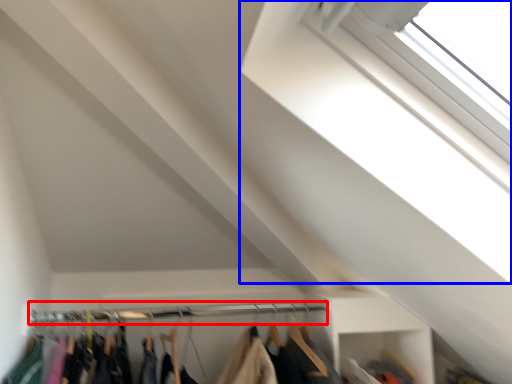
Question: Which of the following is the closest to the observer, clothesline (highlighted by a red box) or window (highlighted by a blue box)?

Choices:
 (A) clothesline
 (B) window

Answer: (B)